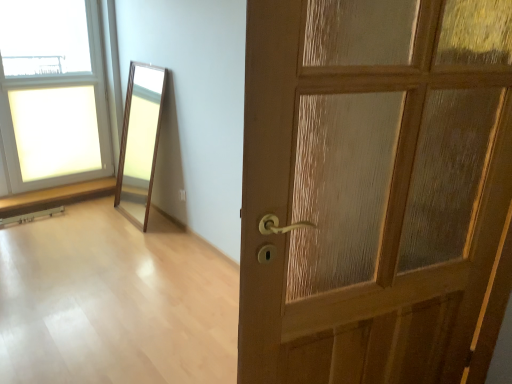
Question: Can we say wooden floor at center lies outside clear glass window at upper left?

Choices:
 (A) yes
 (B) no

Answer: (A)

Question: From a real-world perspective, is wooden floor at center under clear glass window at upper left?

Choices:
 (A) yes
 (B) no

Answer: (A)

Question: Does wooden floor at center lie behind clear glass window at upper left?

Choices:
 (A) yes
 (B) no

Answer: (B)

Question: Is wooden floor at center bigger than clear glass window at upper left?

Choices:
 (A) no
 (B) yes

Answer: (A)

Question: Considering the relative positions of wooden floor at center and clear glass window at upper left in the image provided, is wooden floor at center to the left of clear glass window at upper left from the viewer's perspective?

Choices:
 (A) yes
 (B) no

Answer: (B)

Question: Is wooden floor at center at the right side of clear glass window at upper left?

Choices:
 (A) no
 (B) yes

Answer: (B)

Question: Can you confirm if wooden door at right is thinner than clear glass window at upper left?

Choices:
 (A) yes
 (B) no

Answer: (B)

Question: Are wooden door at right and clear glass window at upper left beside each other?

Choices:
 (A) no
 (B) yes

Answer: (A)

Question: Is wooden door at right positioned far away from clear glass window at upper left?

Choices:
 (A) no
 (B) yes

Answer: (B)

Question: Does wooden door at right have a smaller size compared to clear glass window at upper left?

Choices:
 (A) yes
 (B) no

Answer: (A)

Question: From a real-world perspective, is wooden door at right on clear glass window at upper left?

Choices:
 (A) yes
 (B) no

Answer: (A)

Question: Can you confirm if wooden door at right is taller than clear glass window at upper left?

Choices:
 (A) no
 (B) yes

Answer: (A)

Question: Is clear glass window at upper left positioned with its back to wooden floor at center?

Choices:
 (A) yes
 (B) no

Answer: (B)